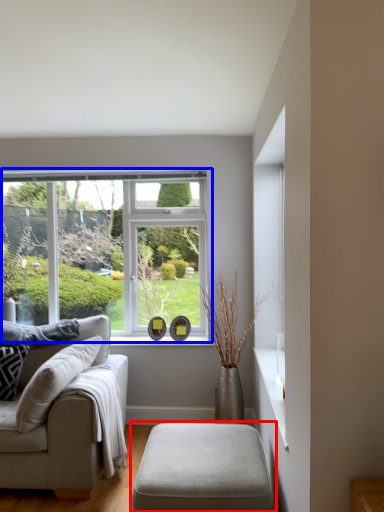
Question: Which of the following is the closest to the observer, table (highlighted by a red box) or window (highlighted by a blue box)?

Choices:
 (A) table
 (B) window

Answer: (A)